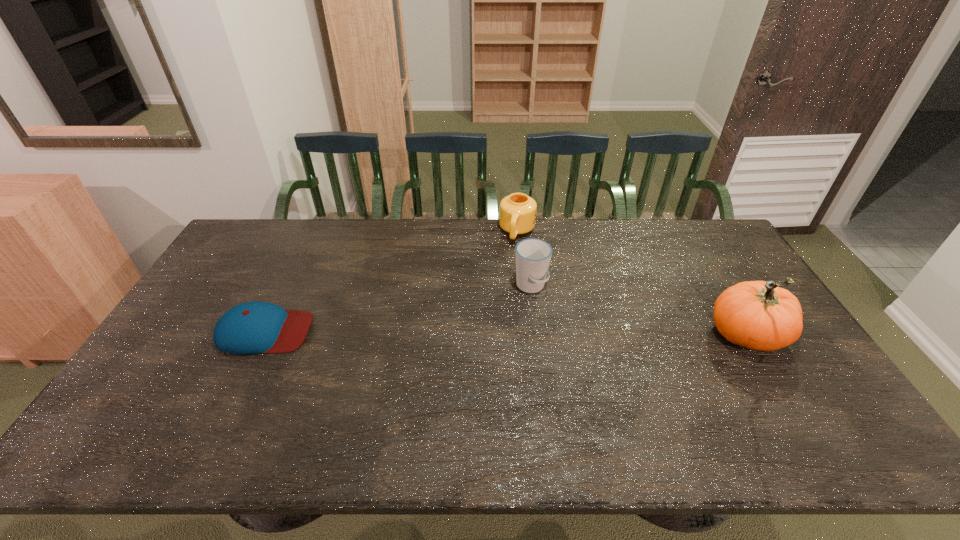
I want to click on free space on the desktop that is between the leftmost object and the rightmost object and is positioned with a handle on the side of the cup, so click(561, 334).

This screenshot has width=960, height=540. Identify the location of free spot on the desktop that is between the leftmost object and the pumpkin and is positioned on the handle side of the mug. (488, 333).